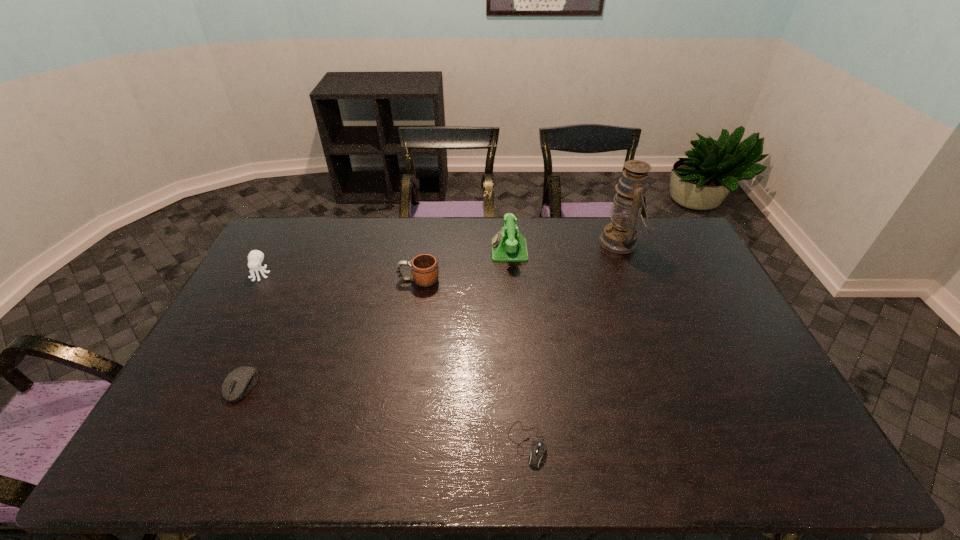
Locate which object ranks third in proximity to the fifth shortest object. Please provide its 2D coordinates. Your answer should be formatted as a tuple, i.e. [(x, y)], where the tuple contains the x and y coordinates of a point satisfying the conditions above.

[(535, 459)]

I want to click on free spot that satisfies the following two spatial constraints: 1. on the front side of the shortest object; 2. on the right side of the fifth object from right to left, so click(x=215, y=444).

At what (x,y) coordinates should I click in order to perform the action: click on free region that satisfies the following two spatial constraints: 1. on the front side of the nearer computer mouse; 2. on the right side of the farther computer mouse. Please return your answer as a coordinate pair (x, y). Looking at the image, I should click on (215, 444).

The height and width of the screenshot is (540, 960). I want to click on blank space that satisfies the following two spatial constraints: 1. on the dial of the nearer computer mouse; 2. on the left side of the telephone, so tap(524, 444).

Identify the location of free point that satisfies the following two spatial constraints: 1. on the back side of the right computer mouse; 2. on the right side of the rightmost object. (511, 242).

Identify the location of free point that satisfies the following two spatial constraints: 1. on the front-facing side of the octopus; 2. on the right side of the second shortest object. (199, 386).

The height and width of the screenshot is (540, 960). Find the location of `free space that satisfies the following two spatial constraints: 1. on the back side of the shortest object; 2. on the side of the mug with the handle`. free space that satisfies the following two spatial constraints: 1. on the back side of the shortest object; 2. on the side of the mug with the handle is located at coordinates (514, 280).

Find the location of `vacant area that satisfies the following two spatial constraints: 1. on the front-facing side of the left computer mouse; 2. on the left side of the octopus`. vacant area that satisfies the following two spatial constraints: 1. on the front-facing side of the left computer mouse; 2. on the left side of the octopus is located at coordinates (199, 386).

Where is `free space that satisfies the following two spatial constraints: 1. on the front-facing side of the right computer mouse; 2. on the right side of the leftmost object`? The height and width of the screenshot is (540, 960). free space that satisfies the following two spatial constraints: 1. on the front-facing side of the right computer mouse; 2. on the right side of the leftmost object is located at coordinates (166, 444).

The width and height of the screenshot is (960, 540). What are the coordinates of `free space that satisfies the following two spatial constraints: 1. on the side of the mug with the handle; 2. on the right side of the shorter computer mouse` in the screenshot? It's located at (394, 444).